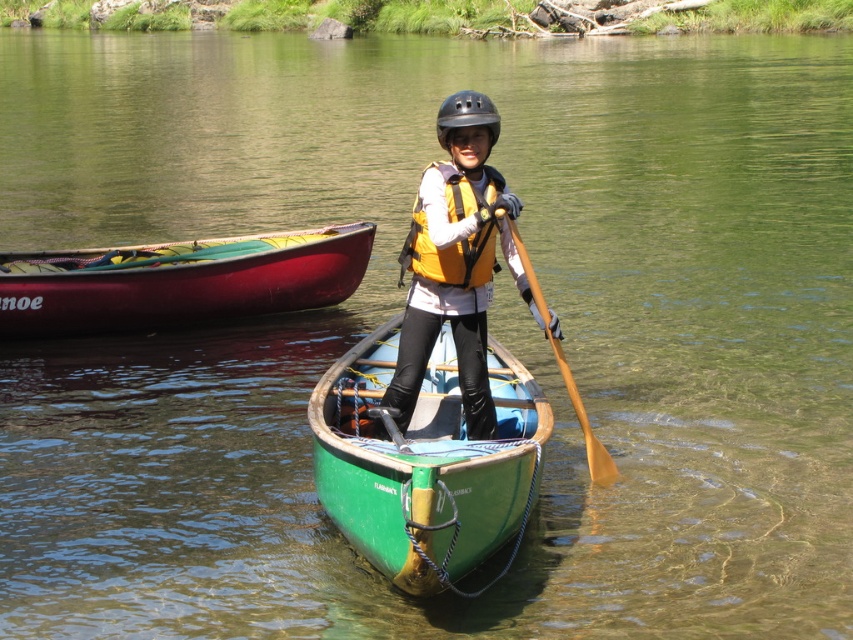
Between green polished wood canoe at center and yellow life vest at center, which one appears on the left side from the viewer's perspective?

green polished wood canoe at center

Does green polished wood canoe at center appear on the right side of yellow life vest at center?

In fact, green polished wood canoe at center is to the left of yellow life vest at center.

Is point (357, 499) behind point (479, 364)?

No.

At what (x,y) coordinates should I click in order to perform the action: click on green polished wood canoe at center. Please return your answer as a coordinate pair (x, y). The image size is (853, 640). Looking at the image, I should click on (426, 464).

Is point (396, 467) positioned after point (525, 260)?

No, it is not.

Identify the location of green polished wood canoe at center. The height and width of the screenshot is (640, 853). (426, 464).

Which is below, yellow matte life jacket at center or black matte helmet at center?

Positioned lower is yellow matte life jacket at center.

Does yellow matte life jacket at center have a lesser height compared to black matte helmet at center?

Indeed, yellow matte life jacket at center has a lesser height compared to black matte helmet at center.

Who is more distant from viewer, (448, 256) or (468, 106)?

The point (448, 256) is behind.

This screenshot has height=640, width=853. I want to click on yellow matte life jacket at center, so click(x=448, y=253).